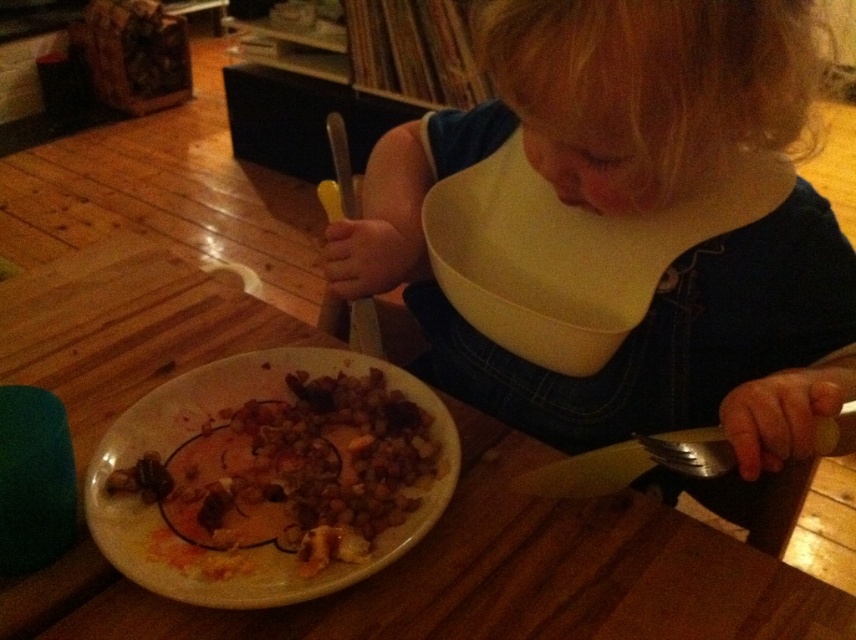
Can you confirm if wooden table at center is positioned below brown crumbly food at plate center?

Yes.

Based on the photo, between wooden table at center and brown crumbly food at plate center, which one has more height?

wooden table at center

Does point (568, 540) lie in front of point (277, 564)?

No, it is behind (277, 564).

Identify the location of wooden table at center. The image size is (856, 640). (484, 577).

Does wooden table at center appear under silver metallic fork at lower right?

Indeed, wooden table at center is positioned under silver metallic fork at lower right.

Between point (622, 616) and point (672, 468), which one is positioned behind?

Positioned behind is point (622, 616).

The height and width of the screenshot is (640, 856). Identify the location of wooden table at center. (484, 577).

Is brown crumbly food at plate center above silver metallic fork at lower right?

No, brown crumbly food at plate center is not above silver metallic fork at lower right.

Measure the distance between point (174, 401) and camera.

Point (174, 401) and camera are 25.01 inches apart from each other.

Where is `brown crumbly food at plate center`? Image resolution: width=856 pixels, height=640 pixels. brown crumbly food at plate center is located at coordinates (272, 470).